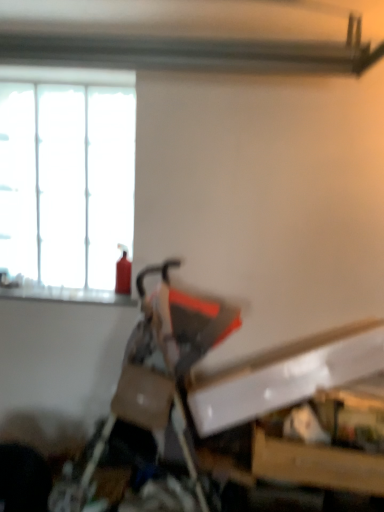
Question: From a real-world perspective, relative to white frosted glass window at upper left, is red matte fire extinguisher at left vertically above or below?

Choices:
 (A) below
 (B) above

Answer: (A)

Question: Would you say red matte fire extinguisher at left is to the left or to the right of white frosted glass window at upper left in the picture?

Choices:
 (A) left
 (B) right

Answer: (B)

Question: Estimate the real-world distances between objects in this image. Which object is farther from the white frosted glass window at upper left?

Choices:
 (A) matte black swivel chair at center
 (B) smooth glass window sill at upper left
 (C) red matte fire extinguisher at left

Answer: (A)

Question: Based on their relative distances, which object is farther from the smooth glass window sill at upper left?

Choices:
 (A) matte black swivel chair at center
 (B) white frosted glass window at upper left
 (C) red matte fire extinguisher at left

Answer: (A)